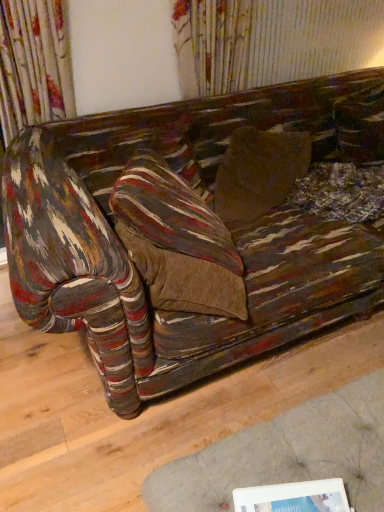
Locate an element on the screen. This screenshot has height=512, width=384. white plastic picture frame at lower right is located at coordinates (294, 497).

What do you see at coordinates (294, 497) in the screenshot?
I see `white plastic picture frame at lower right` at bounding box center [294, 497].

What do you see at coordinates (186, 231) in the screenshot?
I see `textured multicolored fabric couch at center` at bounding box center [186, 231].

Looking at this image, in order to face textured multicolored fabric couch at center, should I rotate leftwards or rightwards?

Rotate your view right by about 9.660°.

Locate an element on the screen. textured multicolored fabric couch at center is located at coordinates (186, 231).

Based on the photo, measure the distance between point (84, 162) and camera.

A distance of 1.58 meters exists between point (84, 162) and camera.

Locate an element on the screen. white plastic picture frame at lower right is located at coordinates click(x=294, y=497).

Can you confirm if white plastic picture frame at lower right is positioned to the left of textured multicolored fabric couch at center?

Yes.

Which is behind, white plastic picture frame at lower right or textured multicolored fabric couch at center?

textured multicolored fabric couch at center is behind.

Between point (240, 490) and point (118, 337), which one is positioned in front?

Point (240, 490)

From the image's perspective, does white plastic picture frame at lower right appear lower than textured multicolored fabric couch at center?

Yes, from the image's perspective, white plastic picture frame at lower right is beneath textured multicolored fabric couch at center.

From a real-world perspective, is white plastic picture frame at lower right located higher than textured multicolored fabric couch at center?

Correct, in the physical world, white plastic picture frame at lower right is higher than textured multicolored fabric couch at center.

Does white plastic picture frame at lower right have a greater width compared to textured multicolored fabric couch at center?

Incorrect, the width of white plastic picture frame at lower right does not surpass that of textured multicolored fabric couch at center.

In the scene shown: Considering the sizes of white plastic picture frame at lower right and textured multicolored fabric couch at center in the image, is white plastic picture frame at lower right taller or shorter than textured multicolored fabric couch at center?

Clearly, white plastic picture frame at lower right is taller compared to textured multicolored fabric couch at center.

Does white plastic picture frame at lower right have a larger size compared to textured multicolored fabric couch at center?

No, white plastic picture frame at lower right is not bigger than textured multicolored fabric couch at center.

Is white plastic picture frame at lower right outside of textured multicolored fabric couch at center?

Yes, white plastic picture frame at lower right is located beyond the bounds of textured multicolored fabric couch at center.

Is white plastic picture frame at lower right not close to textured multicolored fabric couch at center?

Actually, white plastic picture frame at lower right and textured multicolored fabric couch at center are a little close together.

Is white plastic picture frame at lower right oriented away from textured multicolored fabric couch at center?

No, textured multicolored fabric couch at center is not at the back of white plastic picture frame at lower right.

Where is `studio couch below the white plastic picture frame at lower right (from a real-world perspective)`? Image resolution: width=384 pixels, height=512 pixels. studio couch below the white plastic picture frame at lower right (from a real-world perspective) is located at coordinates (186, 231).

Which is more to the left, textured multicolored fabric couch at center or white plastic picture frame at lower right?

Positioned to the left is white plastic picture frame at lower right.

Which object is closer to the camera, textured multicolored fabric couch at center or white plastic picture frame at lower right?

white plastic picture frame at lower right is more forward.

Does point (374, 80) come closer to viewer compared to point (281, 503)?

No, (374, 80) is further to viewer.

From the image's perspective, is textured multicolored fabric couch at center above or below white plastic picture frame at lower right?

From the image's perspective, textured multicolored fabric couch at center appears above white plastic picture frame at lower right.

From a real-world perspective, is textured multicolored fabric couch at center positioned above or below white plastic picture frame at lower right?

In terms of real-world spatial position, textured multicolored fabric couch at center is below white plastic picture frame at lower right.

Does textured multicolored fabric couch at center have a lesser width compared to white plastic picture frame at lower right?

Incorrect, the width of textured multicolored fabric couch at center is not less than that of white plastic picture frame at lower right.

Is textured multicolored fabric couch at center taller or shorter than white plastic picture frame at lower right?

Considering their sizes, textured multicolored fabric couch at center has less height than white plastic picture frame at lower right.

Considering the sizes of objects textured multicolored fabric couch at center and white plastic picture frame at lower right in the image provided, who is bigger, textured multicolored fabric couch at center or white plastic picture frame at lower right?

With larger size is textured multicolored fabric couch at center.

Is textured multicolored fabric couch at center located outside white plastic picture frame at lower right?

textured multicolored fabric couch at center is positioned outside white plastic picture frame at lower right.

Is textured multicolored fabric couch at center in contact with white plastic picture frame at lower right?

No.

Is textured multicolored fabric couch at center oriented away from white plastic picture frame at lower right?

textured multicolored fabric couch at center is not turned away from white plastic picture frame at lower right.

Can you tell me how much textured multicolored fabric couch at center and white plastic picture frame at lower right differ in facing direction?

21.4 degrees.

You are a GUI agent. You are given a task and a screenshot of the screen. Output one action in this format:
    pyautogui.click(x=<x>, y=<y>)
    Task: Click on the studio couch on the right of the white plastic picture frame at lower right
    The width and height of the screenshot is (384, 512).
    Given the screenshot: What is the action you would take?
    pyautogui.click(x=186, y=231)

The height and width of the screenshot is (512, 384). In order to click on picture frame on the left of textured multicolored fabric couch at center in this screenshot , I will do `click(294, 497)`.

You are a GUI agent. You are given a task and a screenshot of the screen. Output one action in this format:
    pyautogui.click(x=<x>, y=<y>)
    Task: Click on the studio couch on the right of white plastic picture frame at lower right
    This screenshot has width=384, height=512.
    Given the screenshot: What is the action you would take?
    pyautogui.click(x=186, y=231)